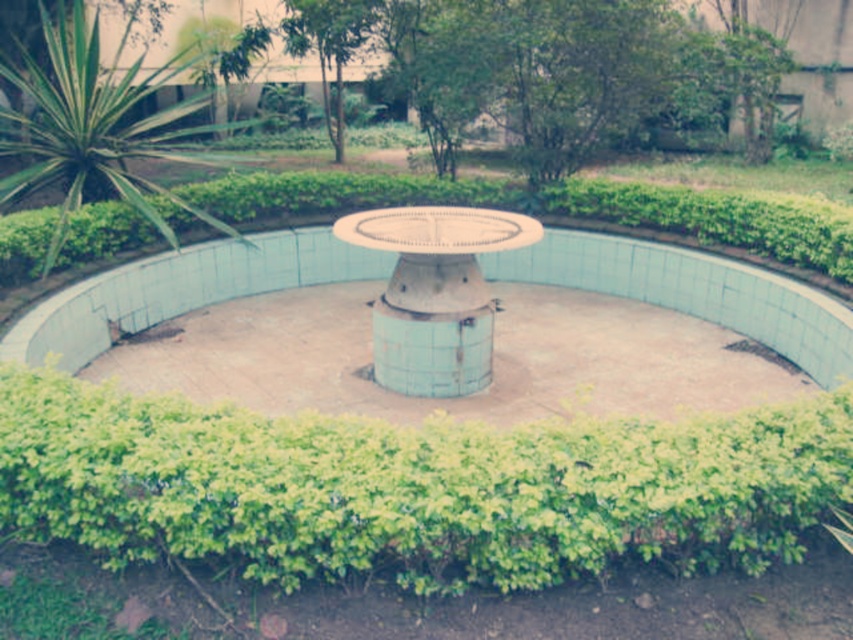
You are standing in the garden and want to take a photo of the blue concrete pool at center and the green leafy bush at left. Which object should you focus on first if you want both to be in sharp focus?

The blue concrete pool at center is closer to the viewer than the green leafy bush at left. To have both in sharp focus, focus on the green leafy bush at left since it is farther away, as depth of field extends behind the point of focus.

You are standing in the garden and want to take a photo of the circular structure. You notice two points marked in the scene at coordinates point (526, 582) and point (267, 323). Which point is better positioned to capture the entire structure in your camera frame?

Point (526, 582) is closer to the camera than point (267, 323), so it would be better positioned to capture the entire structure in your camera frame since it is nearer to the camera.